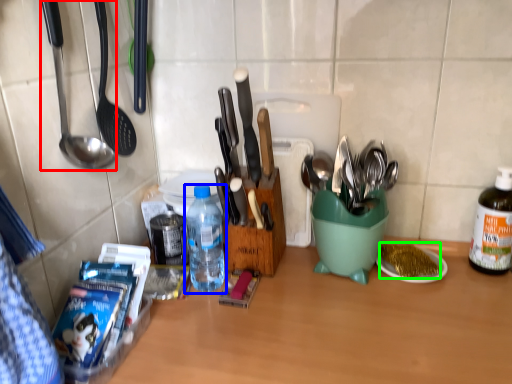
Question: Considering the real-world distances, which object is farthest from spoon (highlighted by a red box)? bottle (highlighted by a blue box) or food (highlighted by a green box)?

Choices:
 (A) bottle
 (B) food

Answer: (B)